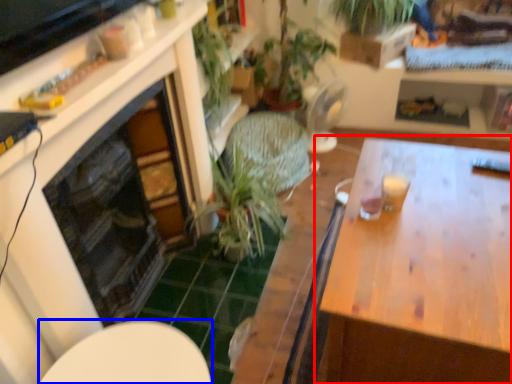
Question: Which point is further to the camera, table (highlighted by a red box) or round table (highlighted by a blue box)?

Choices:
 (A) table
 (B) round table

Answer: (A)